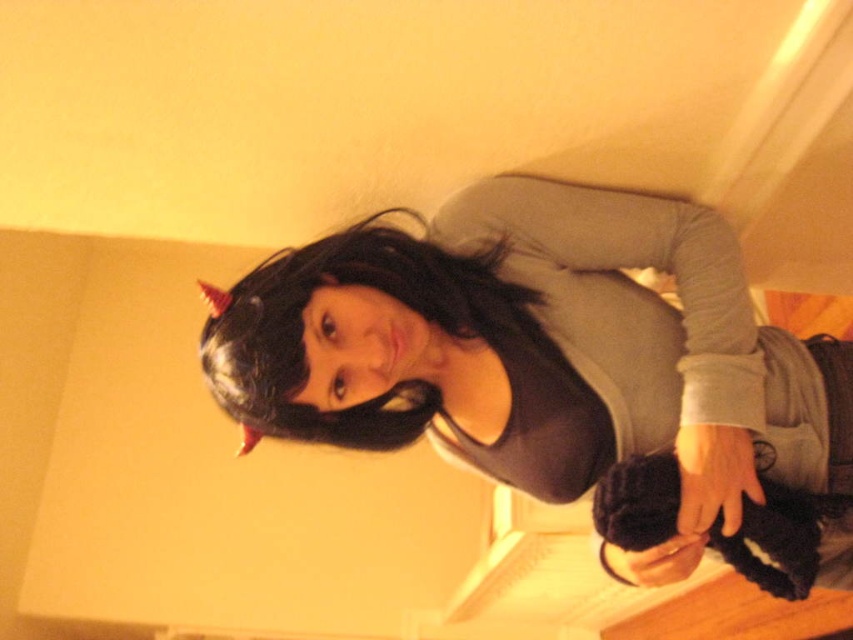
Question: Is black matte wig at upper center above black matte hair at upper center?

Choices:
 (A) no
 (B) yes

Answer: (A)

Question: Which of the following is the farthest from the observer?

Choices:
 (A) black matte hair at upper center
 (B) black matte wig at upper center
 (C) gray matte shirt at upper center

Answer: (C)

Question: Among these points, which one is farthest from the camera?

Choices:
 (A) (350, 282)
 (B) (503, 220)
 (C) (486, 324)

Answer: (B)

Question: Observing the image, what is the correct spatial positioning of gray matte shirt at upper center in reference to black matte hair at upper center?

Choices:
 (A) right
 (B) left

Answer: (A)

Question: Which point is farther to the camera?

Choices:
 (A) black matte wig at upper center
 (B) black matte hair at upper center
 (C) gray matte shirt at upper center

Answer: (C)

Question: Is the position of black matte wig at upper center less distant than that of gray matte shirt at upper center?

Choices:
 (A) yes
 (B) no

Answer: (A)